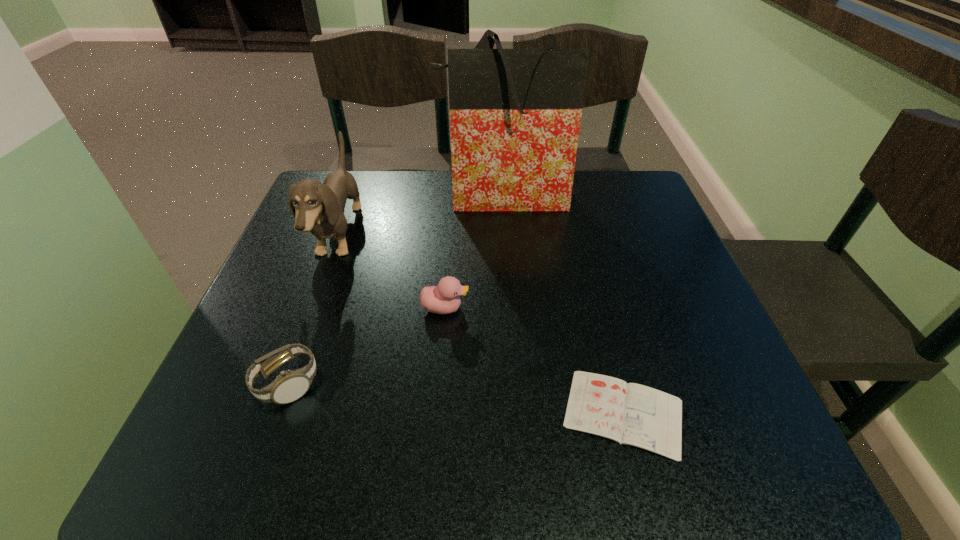
Locate an element on the screen. vacant space that's between the duckling and the diary is located at coordinates (534, 361).

Locate an element on the screen. unoccupied position between the second shortest object and the tallest object is located at coordinates (395, 291).

Where is `free area in between the fourth tallest object and the shortest object`? This screenshot has width=960, height=540. free area in between the fourth tallest object and the shortest object is located at coordinates (455, 399).

The image size is (960, 540). In order to click on free spot between the second shortest object and the shortest object in this screenshot , I will do `click(455, 399)`.

This screenshot has height=540, width=960. I want to click on free space that is in between the fourth shortest object and the duckling, so click(x=392, y=272).

Identify which object is the fourth closest to the shopping bag. Please provide its 2D coordinates. Your answer should be formatted as a tuple, i.e. [(x, y)], where the tuple contains the x and y coordinates of a point satisfying the conditions above.

[(289, 386)]

At what (x,y) coordinates should I click in order to perform the action: click on object identified as the fourth closest to the tallest object. Please return your answer as a coordinate pair (x, y). This screenshot has width=960, height=540. Looking at the image, I should click on (289, 386).

This screenshot has height=540, width=960. I want to click on free point that satisfies the following two spatial constraints: 1. on the front-facing side of the duckling; 2. on the right side of the diary, so click(437, 413).

Where is `vacant position in the image that satisfies the following two spatial constraints: 1. on the front side of the tallest object; 2. on the left side of the diary`? Image resolution: width=960 pixels, height=540 pixels. vacant position in the image that satisfies the following two spatial constraints: 1. on the front side of the tallest object; 2. on the left side of the diary is located at coordinates (516, 413).

Locate an element on the screen. This screenshot has width=960, height=540. vacant position in the image that satisfies the following two spatial constraints: 1. on the front side of the shopping bag; 2. at the face of the second tallest object is located at coordinates click(x=505, y=235).